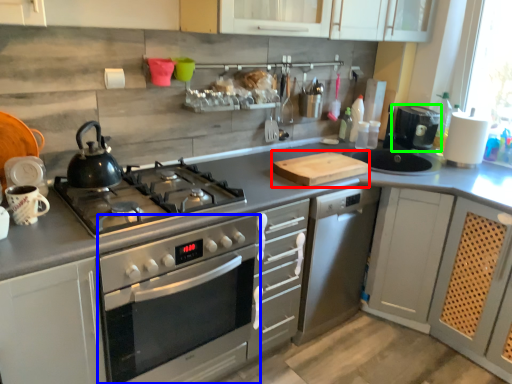
Question: Which is nearer to the cutting board (highlighted by a red box)? oven (highlighted by a blue box) or coffee machine (highlighted by a green box).

Choices:
 (A) oven
 (B) coffee machine

Answer: (A)